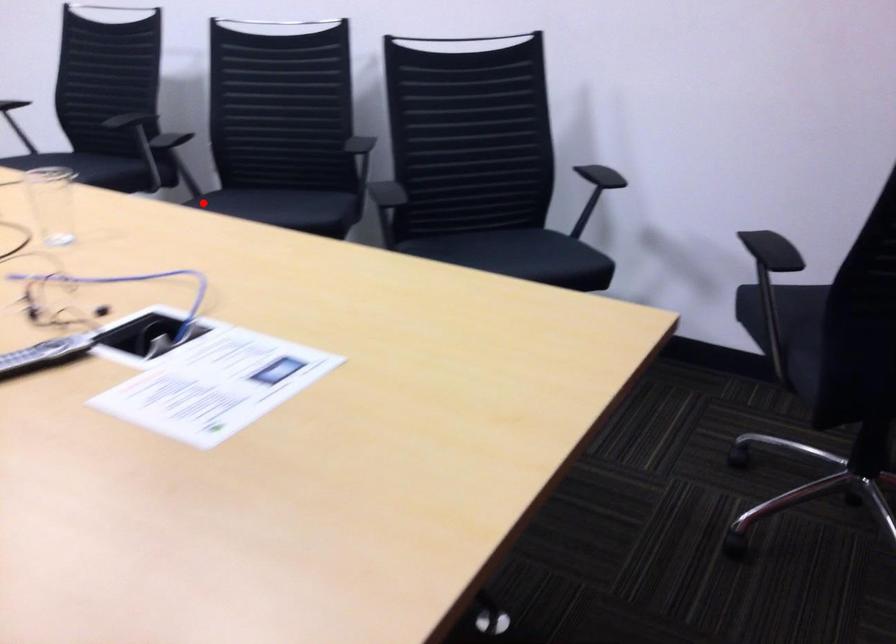
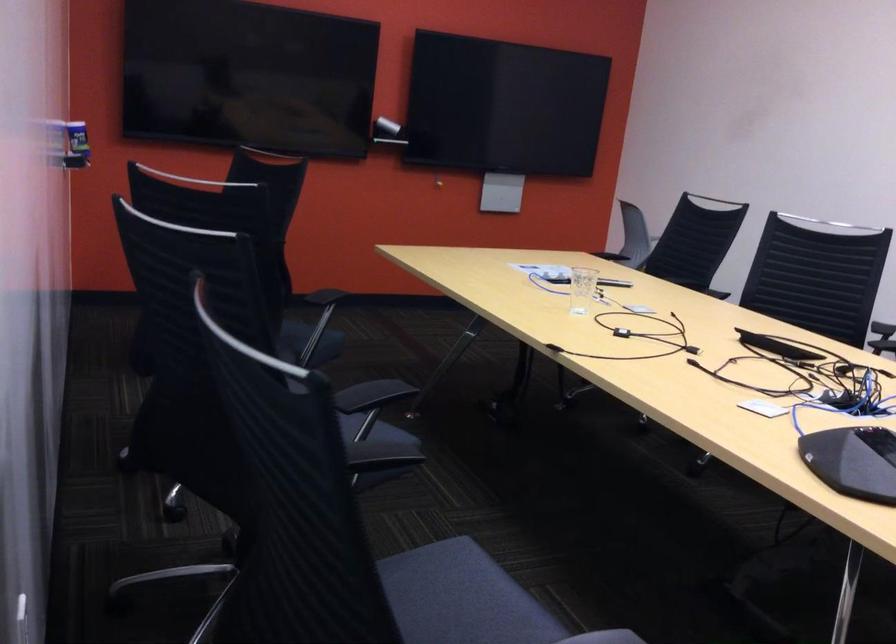
Question: I am providing you with two images of the same scene from different viewpoints. Image1 has a red point marked. In image2, the corresponding 3D location appears at what relative position? Reply with the corresponding letter.

Choices:
 (A) Closer
 (B) Farther

Answer: (A)